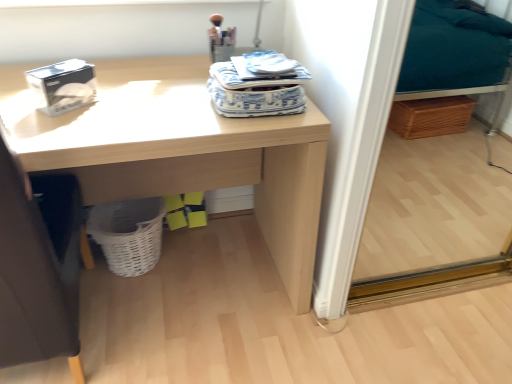
The image size is (512, 384). Find the location of `free space to the back side of white matte tissue box at upper left, positioned as the second box in right-to-left order`. free space to the back side of white matte tissue box at upper left, positioned as the second box in right-to-left order is located at coordinates (119, 77).